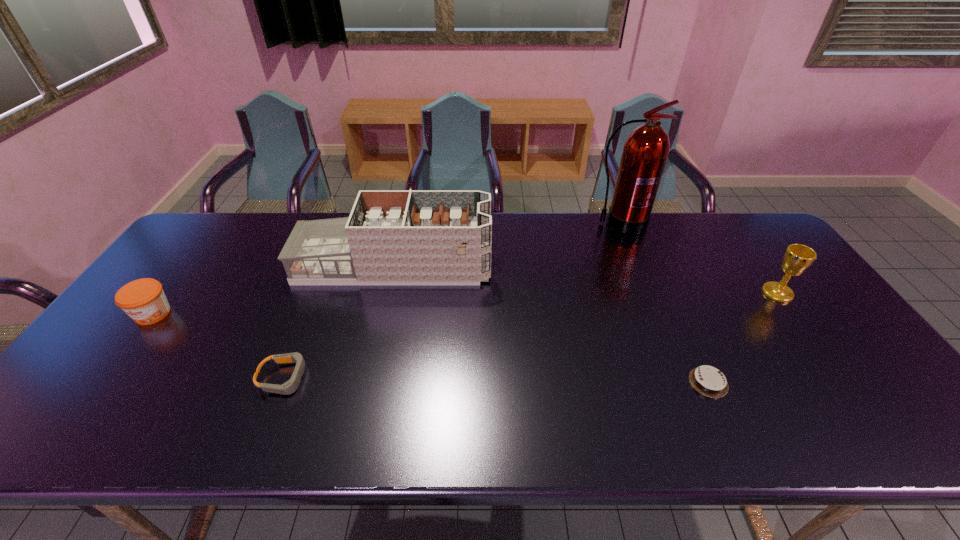
Locate an element on the screen. The image size is (960, 540). fire extinguisher is located at coordinates (646, 150).

In order to click on the tallest object in this screenshot , I will do `click(646, 150)`.

You are a GUI agent. You are given a task and a screenshot of the screen. Output one action in this format:
    pyautogui.click(x=<x>, y=<y>)
    Task: Click on the second tallest object
    This screenshot has height=540, width=960.
    Given the screenshot: What is the action you would take?
    pyautogui.click(x=392, y=237)

The width and height of the screenshot is (960, 540). I want to click on the rightmost object, so pyautogui.click(x=797, y=258).

Locate an element on the screen. This screenshot has width=960, height=540. the fourth shortest object is located at coordinates (797, 258).

Identify the location of the fourth tallest object. The height and width of the screenshot is (540, 960). pyautogui.click(x=143, y=300).

Find the location of `the leftmost object`. the leftmost object is located at coordinates (143, 300).

Where is `goggles`? This screenshot has width=960, height=540. goggles is located at coordinates (289, 387).

I want to click on the shortest object, so (x=709, y=381).

Locate an element on the screen. The height and width of the screenshot is (540, 960). free region located on the front-facing side of the farthest object is located at coordinates (642, 282).